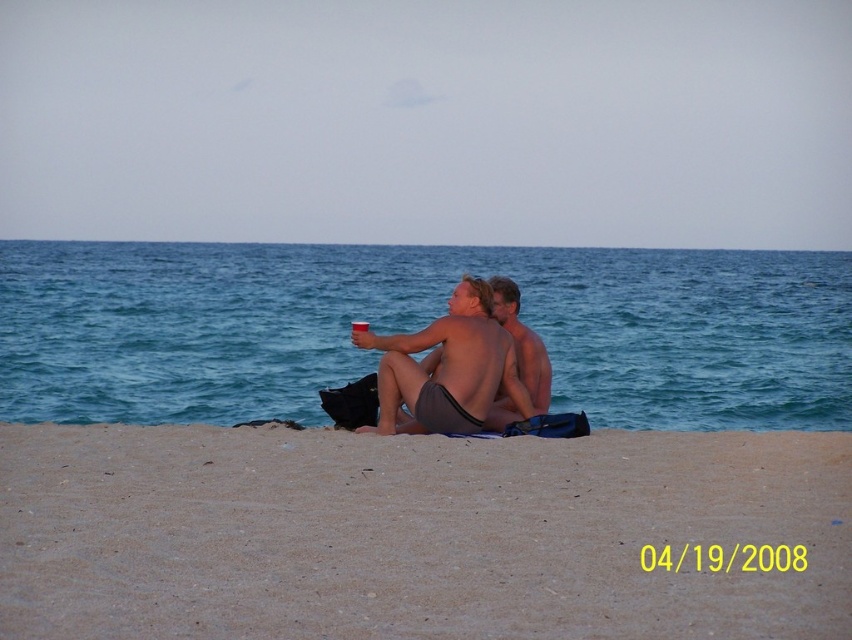
Which of these two, brown sand at lower center or smooth skin torso at center, stands shorter?

brown sand at lower center

Which is more to the left, brown sand at lower center or smooth skin torso at center?

smooth skin torso at center is more to the left.

You are a GUI agent. You are given a task and a screenshot of the screen. Output one action in this format:
    pyautogui.click(x=<x>, y=<y>)
    Task: Click on the brown sand at lower center
    The image size is (852, 640).
    Given the screenshot: What is the action you would take?
    pyautogui.click(x=415, y=534)

Can you confirm if brown sand at lower center is taller than matte skin at center?

No, brown sand at lower center is not taller than matte skin at center.

Which is below, brown sand at lower center or matte skin at center?

brown sand at lower center is lower down.

Locate an element on the screen. This screenshot has height=640, width=852. brown sand at lower center is located at coordinates [415, 534].

Who is positioned more to the left, matte skin at center or smooth skin torso at center?

matte skin at center is more to the left.

From the picture: Is matte skin at center below smooth skin torso at center?

Indeed, matte skin at center is positioned under smooth skin torso at center.

Between point (413, 433) and point (545, 392), which one is positioned in front?

Point (413, 433) is in front.

This screenshot has width=852, height=640. Identify the location of matte skin at center. (448, 369).